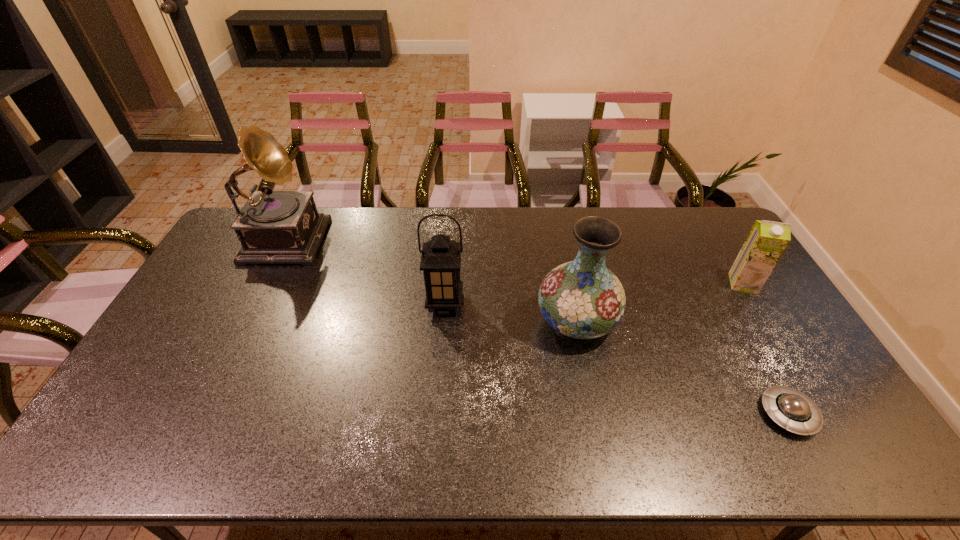
Locate an element on the screen. This screenshot has height=540, width=960. object that can be found as the second closest to the second object from left to right is located at coordinates (274, 227).

The width and height of the screenshot is (960, 540). What are the coordinates of `free space that satisfies the following two spatial constraints: 1. on the back side of the lantern; 2. on the horn of the record player` in the screenshot? It's located at (450, 235).

In order to click on free region that satisfies the following two spatial constraints: 1. on the back side of the vase; 2. on the left side of the second shortest object in this screenshot , I will do `click(569, 284)`.

The height and width of the screenshot is (540, 960). Identify the location of free point that satisfies the following two spatial constraints: 1. on the horn of the record player; 2. on the back side of the shortest object. (198, 414).

I want to click on vacant region that satisfies the following two spatial constraints: 1. on the horn of the fourth tallest object; 2. on the left side of the farthest object, so click(263, 284).

In order to click on vacant position in the image that satisfies the following two spatial constraints: 1. on the horn of the soya milk; 2. on the left side of the farthest object in this screenshot , I will do `click(263, 284)`.